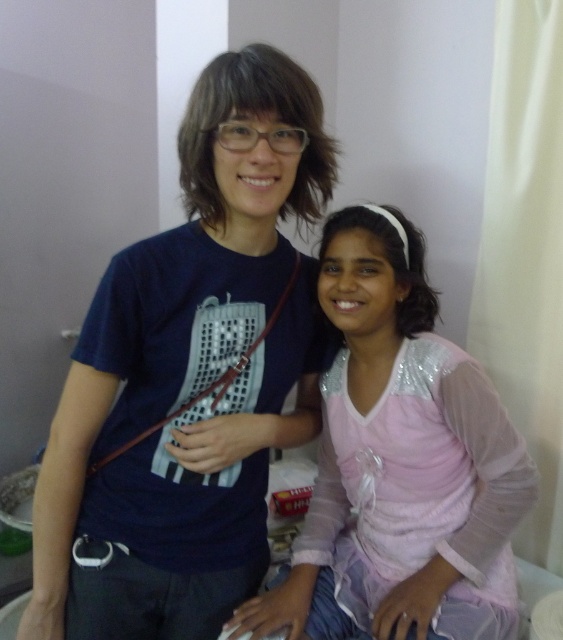
Question: Which object is farther from the camera taking this photo?

Choices:
 (A) pink satin dress at center
 (B) blue matte t-shirt at center

Answer: (A)

Question: Is blue matte t-shirt at center bigger than pink satin dress at center?

Choices:
 (A) no
 (B) yes

Answer: (B)

Question: Can you confirm if blue matte t-shirt at center is positioned to the right of pink satin dress at center?

Choices:
 (A) no
 (B) yes

Answer: (A)

Question: Is blue matte t-shirt at center smaller than pink satin dress at center?

Choices:
 (A) yes
 (B) no

Answer: (B)

Question: Which object appears farthest from the camera in this image?

Choices:
 (A) blue matte t-shirt at center
 (B) pink satin dress at center

Answer: (B)